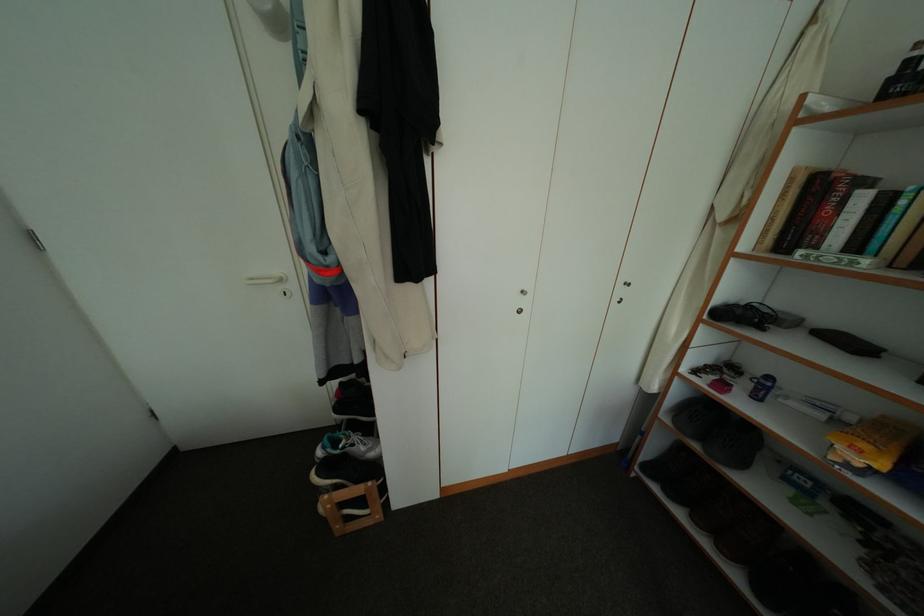
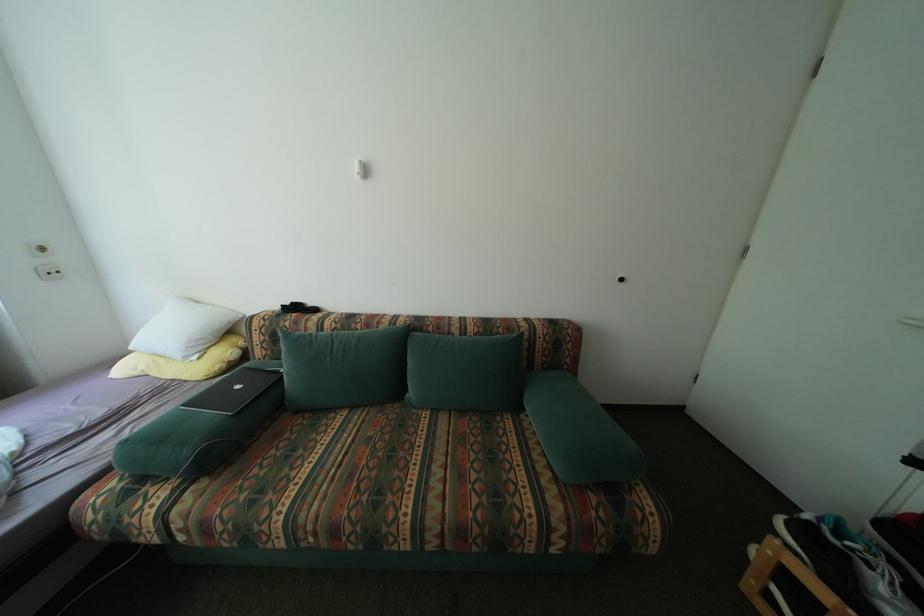
First-person continuous shooting, in which direction is the camera rotating?

The rotation direction of the camera is left-down.